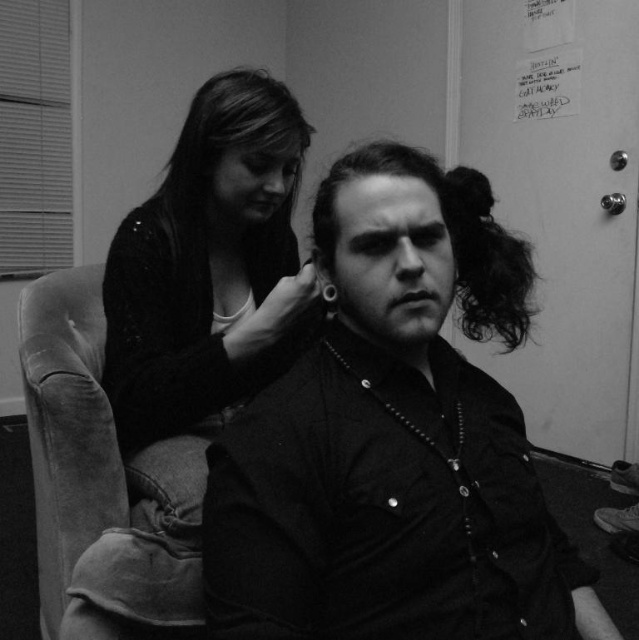
Question: Is the position of matte black shirt at center less distant than that of matte black sweater at upper left?

Choices:
 (A) no
 (B) yes

Answer: (B)

Question: Is matte black shirt at center in front of matte black sweater at upper left?

Choices:
 (A) no
 (B) yes

Answer: (B)

Question: Which of the following is the closest to the observer?

Choices:
 (A) (187, 342)
 (B) (272, 563)
 (C) (364, 148)

Answer: (B)

Question: Which object is closer to the camera taking this photo?

Choices:
 (A) dark curly hair at center
 (B) matte black sweater at upper left
 (C) matte black shirt at center

Answer: (C)

Question: Is matte black shirt at center to the right of matte black sweater at upper left from the viewer's perspective?

Choices:
 (A) yes
 (B) no

Answer: (A)

Question: Which of the following is the closest to the observer?

Choices:
 (A) matte black shirt at center
 (B) matte black sweater at upper left
 (C) dark curly hair at center

Answer: (A)